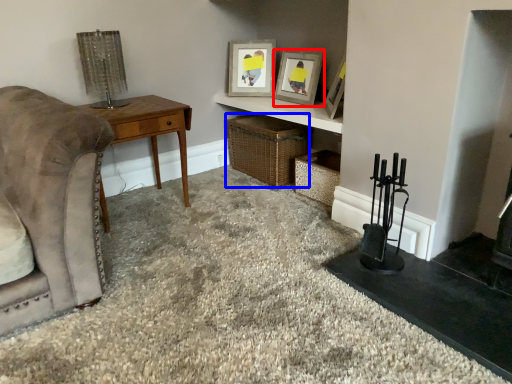
Question: Which object is further to the camera taking this photo, picture frame (highlighted by a red box) or crate (highlighted by a blue box)?

Choices:
 (A) picture frame
 (B) crate

Answer: (B)